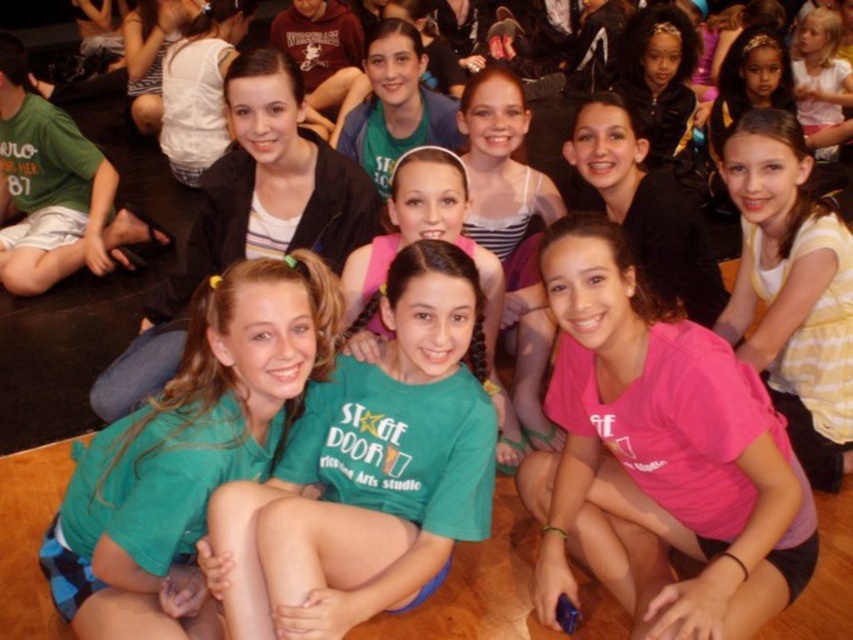
Which of these two, pink matte shirt at lower right or green matte shirt at center, stands taller?

pink matte shirt at lower right is taller.

Which is in front, point (675, 372) or point (341, 572)?

Point (341, 572) is in front.

Where is `pink matte shirt at lower right`? The image size is (853, 640). pink matte shirt at lower right is located at coordinates (659, 456).

Who is more forward, (639, 561) or (193, 372)?

Point (193, 372) is in front.

Is the position of pink matte shirt at lower right less distant than that of green fabric shirt at center?

That is True.

This screenshot has height=640, width=853. What do you see at coordinates (659, 456) in the screenshot?
I see `pink matte shirt at lower right` at bounding box center [659, 456].

Identify the location of pink matte shirt at lower right. This screenshot has height=640, width=853. (659, 456).

Between green matte shirt at center and green fabric shirt at center, which one appears on the left side from the viewer's perspective?

Positioned to the left is green fabric shirt at center.

The height and width of the screenshot is (640, 853). Identify the location of green matte shirt at center. (366, 472).

Where is `green matte shirt at center`? The height and width of the screenshot is (640, 853). green matte shirt at center is located at coordinates (366, 472).